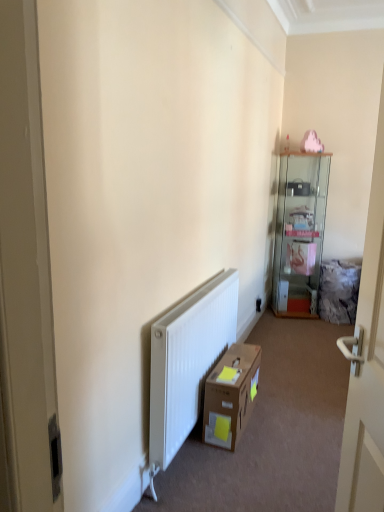
Question: In the image, is brown cardboard box at lower center positioned in front of or behind white glossy door at right?

Choices:
 (A) front
 (B) behind

Answer: (B)

Question: From the image's perspective, is brown cardboard box at lower center positioned above or below white glossy door at right?

Choices:
 (A) below
 (B) above

Answer: (A)

Question: Considering the real-world distances, which object is farthest from the brown cardboard box at lower center?

Choices:
 (A) white glossy door at right
 (B) clear glass cabinet at upper right
 (C) black plastic electric outlet at center

Answer: (B)

Question: Which is nearer to the brown cardboard box at lower center?

Choices:
 (A) white glossy door at right
 (B) clear glass cabinet at upper right
 (C) black plastic electric outlet at center

Answer: (A)